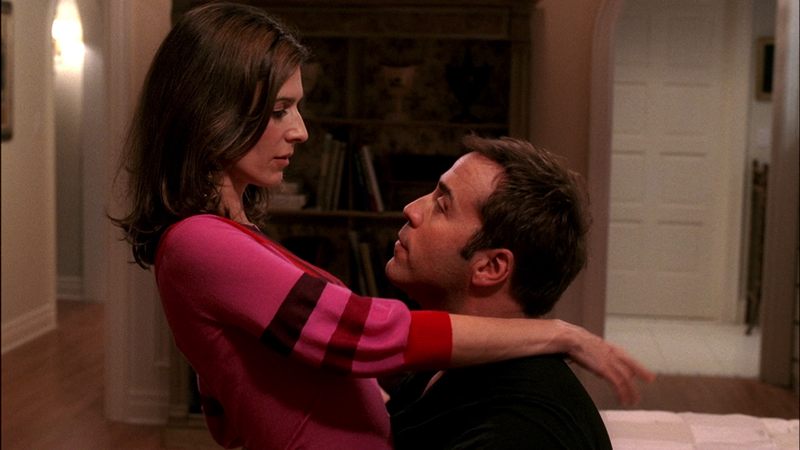
The height and width of the screenshot is (450, 800). In order to click on picture in this screenshot , I will do `click(761, 79)`.